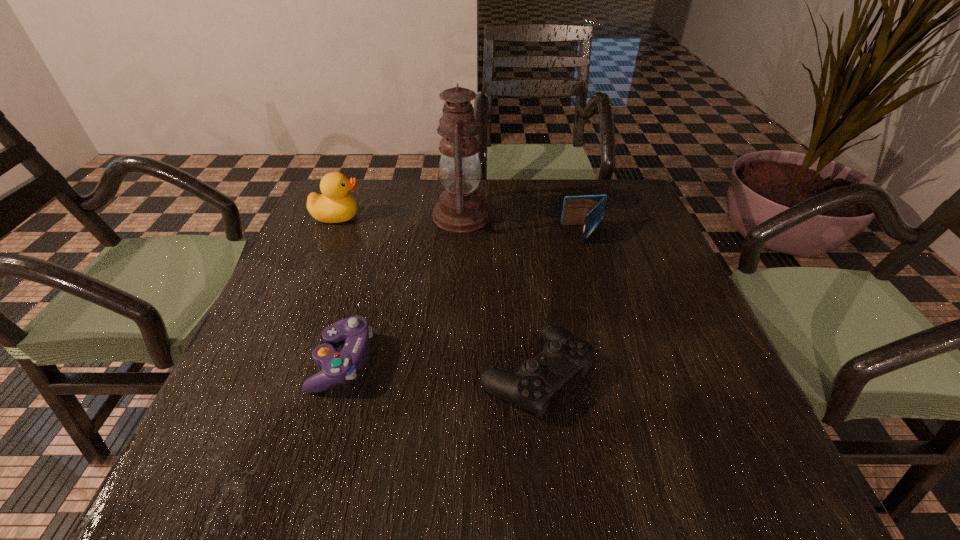
Find the location of a particular element. Image resolution: width=960 pixels, height=540 pixels. object located in the far left corner section of the desktop is located at coordinates (334, 205).

Where is `object that is positioned at the far right corner`? object that is positioned at the far right corner is located at coordinates (587, 210).

This screenshot has height=540, width=960. I want to click on vacant space at the far edge of the desktop, so click(x=514, y=197).

In the image, there is a desktop. What are the coordinates of `blank space at the near edge` in the screenshot? It's located at (423, 462).

You are a GUI agent. You are given a task and a screenshot of the screen. Output one action in this format:
    pyautogui.click(x=<x>, y=<y>)
    Task: Click on the vacant position at the left edge of the desktop
    
    Given the screenshot: What is the action you would take?
    click(x=300, y=402)

Image resolution: width=960 pixels, height=540 pixels. Identify the location of free space at the right edge. (658, 291).

Locate an element on the screen. This screenshot has width=960, height=540. vacant space at the near left corner of the desktop is located at coordinates (229, 444).

The width and height of the screenshot is (960, 540). I want to click on vacant space at the far right corner of the desktop, so click(609, 178).

At what (x,y) coordinates should I click in order to perform the action: click on free space that is in between the right control and the oil lamp. Please return your answer as a coordinate pair (x, y). Looking at the image, I should click on (498, 295).

Where is `free area in between the oil lamp and the fourth shortest object`? This screenshot has width=960, height=540. free area in between the oil lamp and the fourth shortest object is located at coordinates (399, 216).